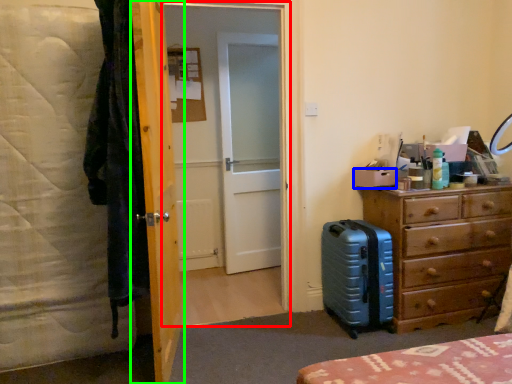
Question: Estimate the real-world distances between objects in this image. Which object is closer to screen door (highlighted by a red box), box (highlighted by a blue box) or door (highlighted by a green box)?

Choices:
 (A) box
 (B) door

Answer: (B)